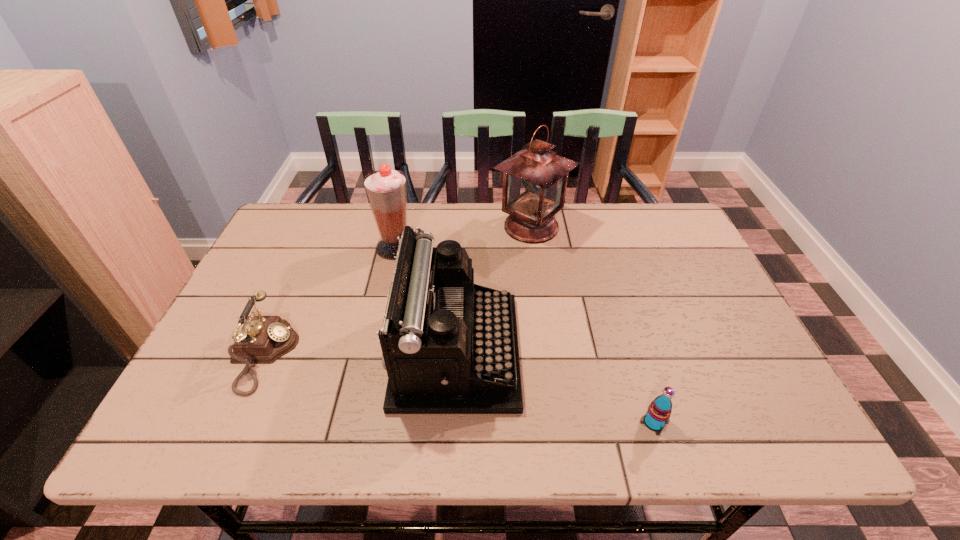
This screenshot has width=960, height=540. I want to click on oil lamp present at the far edge, so click(535, 178).

Find the location of a particular element. The image size is (960, 540). smoothie present at the far edge is located at coordinates (386, 189).

At what (x,y) coordinates should I click in order to perform the action: click on typewriter present at the near edge. Please return your answer as a coordinate pair (x, y). Looking at the image, I should click on (449, 346).

Find the location of a particular element. soda situated at the near edge is located at coordinates (659, 411).

Where is `object present at the left edge`? The width and height of the screenshot is (960, 540). object present at the left edge is located at coordinates (263, 339).

In the image, there is a desktop. Where is `free space at the far edge`? free space at the far edge is located at coordinates (580, 235).

Where is `free space at the near edge`? Image resolution: width=960 pixels, height=540 pixels. free space at the near edge is located at coordinates (539, 419).

You are a GUI agent. You are given a task and a screenshot of the screen. Output one action in this format:
    pyautogui.click(x=<x>, y=<y>)
    Task: Click on the vacant space at the left edge of the desktop
    This screenshot has height=540, width=960.
    Given the screenshot: What is the action you would take?
    pyautogui.click(x=297, y=265)

Locate an element on the screen. free space at the right edge of the desktop is located at coordinates (733, 350).

The image size is (960, 540). I want to click on free space between the soda and the typewriter, so click(x=555, y=387).